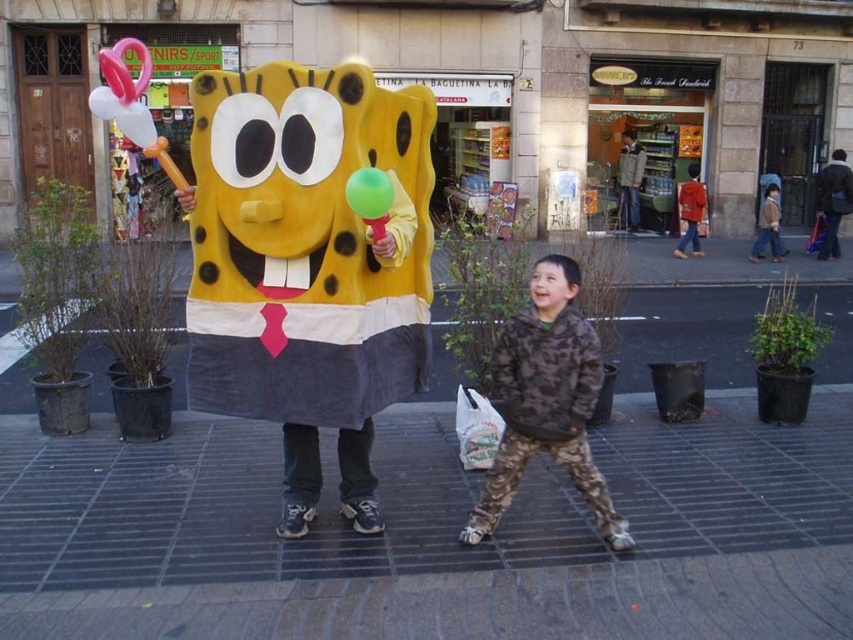
Who is taller, camouflage jacket at center or green rubber balloon at center?

camouflage jacket at center is taller.

Who is lower down, camouflage jacket at center or green rubber balloon at center?

camouflage jacket at center is lower down.

Which is in front, point (546, 401) or point (368, 177)?

Point (368, 177) is in front.

Locate an element on the screen. The width and height of the screenshot is (853, 640). camouflage jacket at center is located at coordinates (546, 401).

Is matte yellow sponge at center closer to camera compared to camouflage jacket at center?

Yes.

Which is more to the right, matte yellow sponge at center or camouflage jacket at center?

camouflage jacket at center

Does point (262, 275) come closer to viewer compared to point (570, 474)?

Yes, it is in front of point (570, 474).

The width and height of the screenshot is (853, 640). I want to click on matte yellow sponge at center, so click(x=306, y=266).

Does matte yellow sponge at center appear over green rubber balloon at center?

Incorrect, matte yellow sponge at center is not positioned above green rubber balloon at center.

Does point (374, 372) lie in front of point (372, 195)?

No, it is not.

Identify the location of matte yellow sponge at center. This screenshot has width=853, height=640. (306, 266).